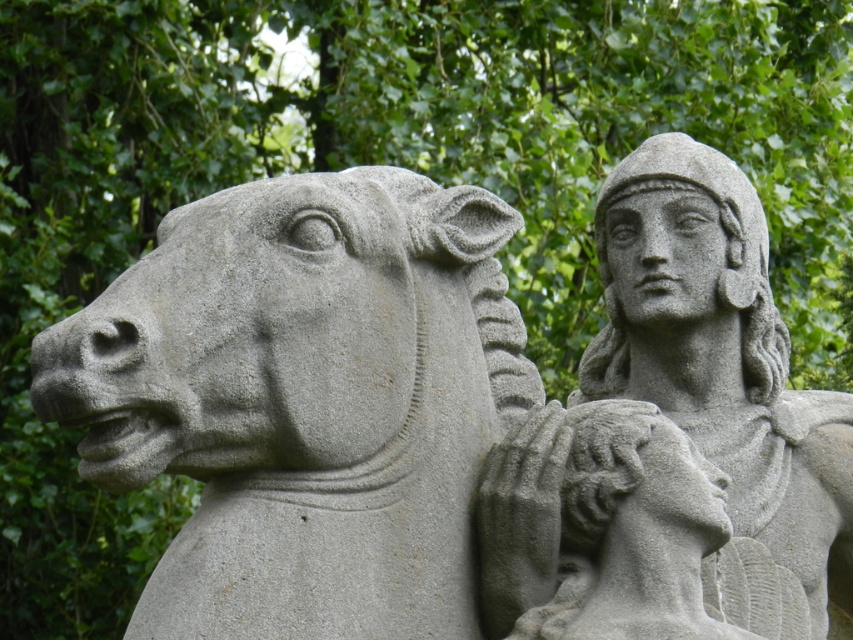
You are an art conservator examining the sculpture. You need to place a protective barrier around the gray stone horse at left and the gray stone warrior at upper right. Which object requires a wider barrier to accommodate its size?

The gray stone warrior at upper right requires a wider barrier because it has a greater width than the gray stone horse at left.

You are an archaeologist examining the stone sculpture. You notice the gray stone warrior at upper right and the gray stone head at center. Based on their positions, which object is located to the right of the other?

The gray stone warrior at upper right is positioned on the right side of the gray stone head at center.